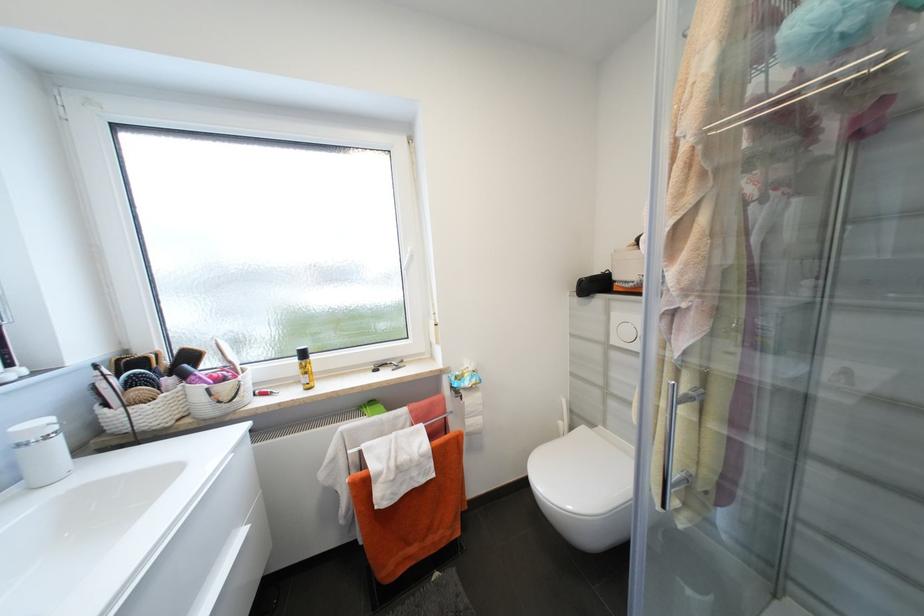
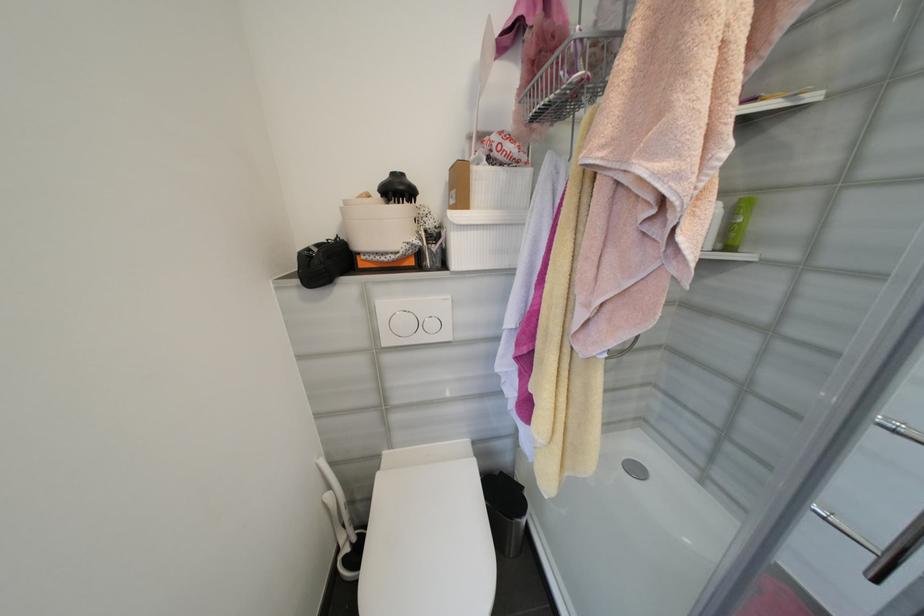
Question: Based on the continuous images, in which direction is the camera rotating? Reply with the corresponding letter.

Choices:
 (A) Left
 (B) Right
 (C) Up
 (D) Down

Answer: (B)